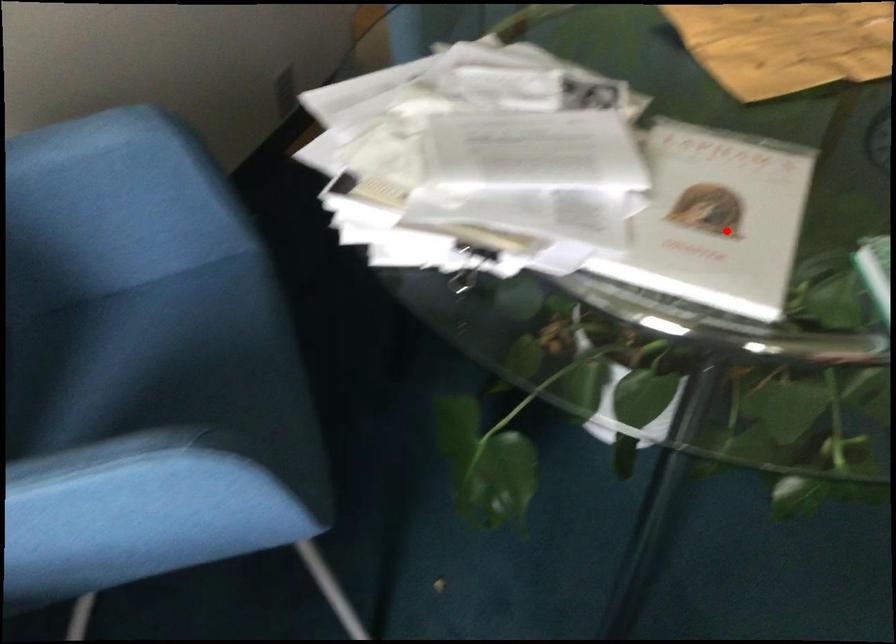
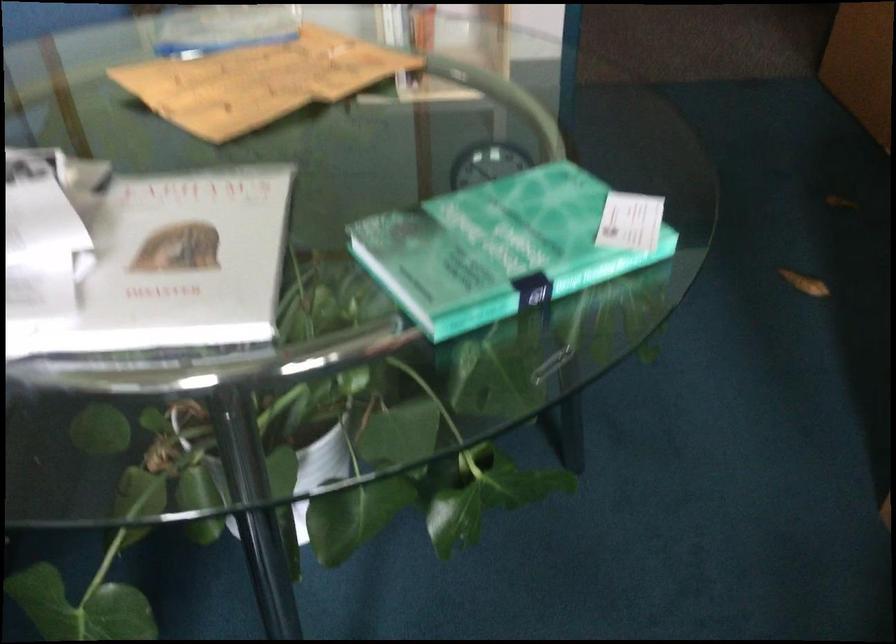
Question: I am providing you with two images of the same scene from different viewpoints. A red point is marked on the first image. Is the red point's position out of view in image 2?

Choices:
 (A) Yes
 (B) No

Answer: (B)